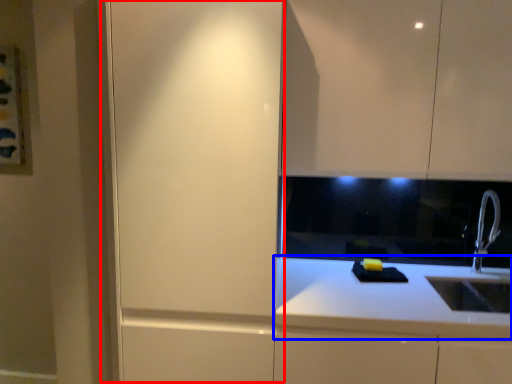
Question: Which object appears closest to the camera in this image, screen door (highlighted by a red box) or countertop (highlighted by a blue box)?

Choices:
 (A) screen door
 (B) countertop

Answer: (A)